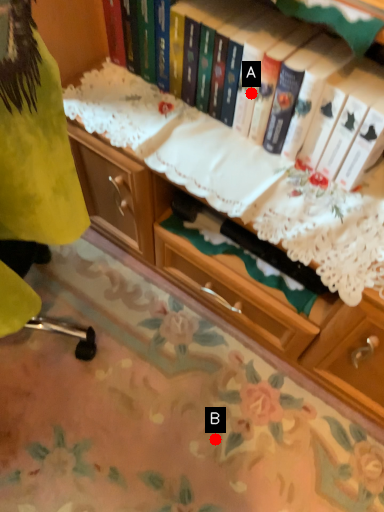
Question: Two points are circled on the image, labeled by A and B beside each circle. Which point appears farthest from the camera in this image?

Choices:
 (A) A is further
 (B) B is further

Answer: (B)